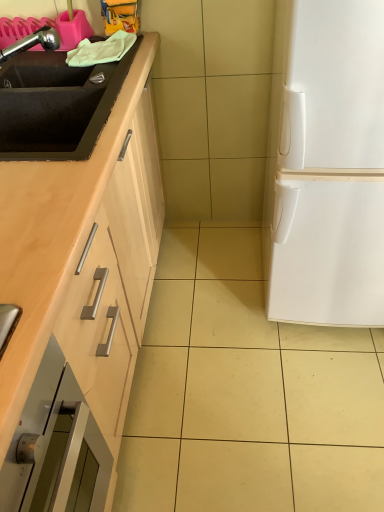
This screenshot has height=512, width=384. Find the location of `vacant area on the back side of chrome metallic faucet at upper left, the second sink from the bottom`. vacant area on the back side of chrome metallic faucet at upper left, the second sink from the bottom is located at coordinates (38, 65).